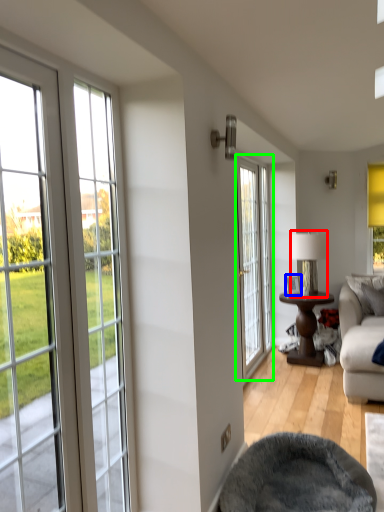
Question: Which is farther away from lamp (highlighted by a red box)? picture frame (highlighted by a blue box) or door (highlighted by a green box)?

Choices:
 (A) picture frame
 (B) door

Answer: (B)